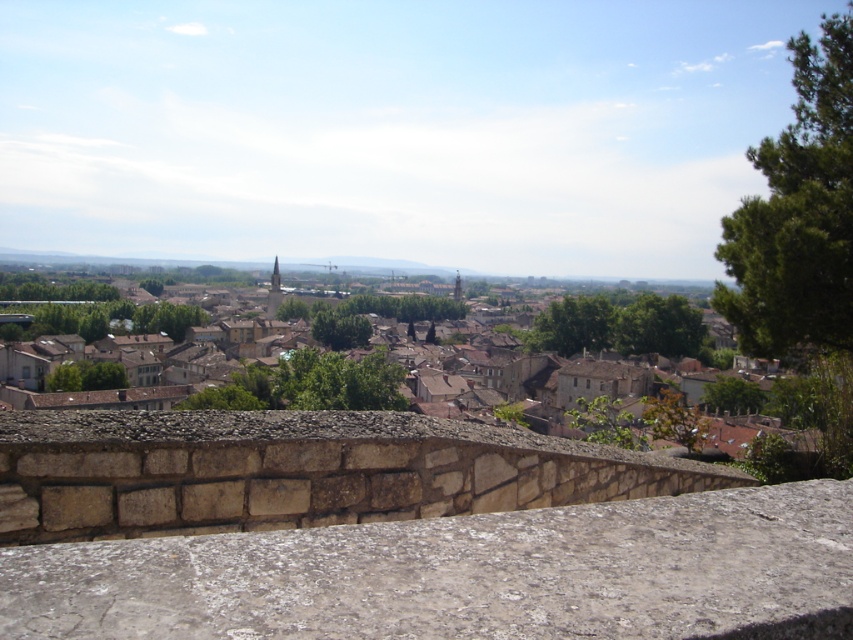
You are standing on the stone ledge at center and want to look over to see the brown stone town at center. Considering their heights, will you be able to see the tops of the buildings in the town clearly?

The stone ledge at center has a lesser height compared to brown stone town at center, so you will not be able to see the tops of the buildings in the town clearly because the town is taller than the ledge.

Based on the photo, you are standing at the point labeled as point (466, 573) in the image. What is the surface you are touching?

The surface you are touching is the rough stone ledge at center, as point (466, 573) corresponds to that location.